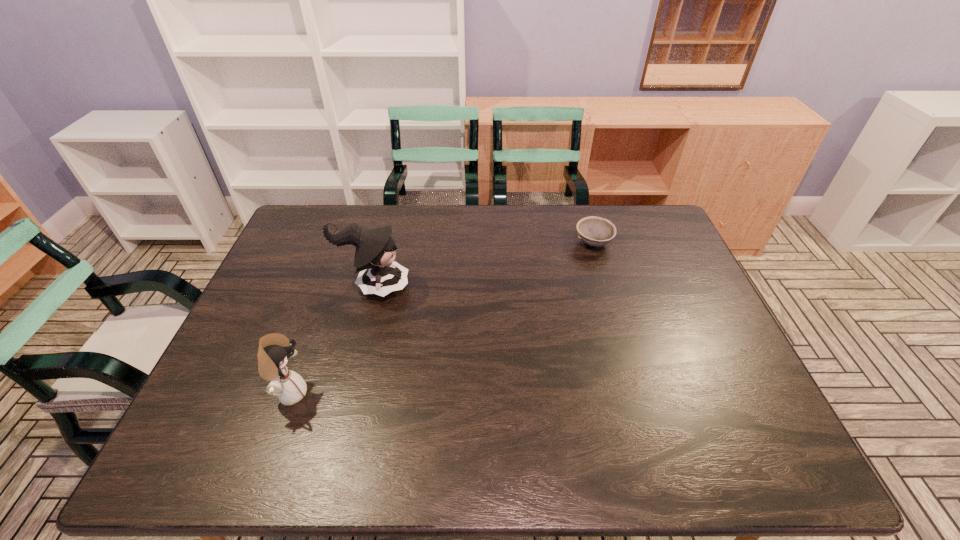
The image size is (960, 540). In order to click on vacant space at the far edge of the desktop in this screenshot , I will do `click(549, 225)`.

In the image, there is a desktop. Identify the location of free space at the near edge. The height and width of the screenshot is (540, 960). (445, 440).

You are a GUI agent. You are given a task and a screenshot of the screen. Output one action in this format:
    pyautogui.click(x=<x>, y=<y>)
    Task: Click on the vacant space at the left edge
    The height and width of the screenshot is (540, 960).
    Given the screenshot: What is the action you would take?
    pyautogui.click(x=256, y=424)

I want to click on vacant space at the right edge of the desktop, so click(x=705, y=319).

Image resolution: width=960 pixels, height=540 pixels. Find the location of `vacant space at the far left corner`. vacant space at the far left corner is located at coordinates (302, 220).

The image size is (960, 540). What are the coordinates of `free region at the far right corner of the desktop` in the screenshot? It's located at (647, 213).

Image resolution: width=960 pixels, height=540 pixels. What are the coordinates of `free space at the near right corner of the desktop` in the screenshot? It's located at (717, 446).

Locate an element on the screen. This screenshot has width=960, height=540. vacant area between the shorter doll and the bowl is located at coordinates (442, 318).

The width and height of the screenshot is (960, 540). I want to click on free space between the shorter doll and the bowl, so click(442, 318).

Where is `vacant area that lies between the nearest object and the rightmost object`? The image size is (960, 540). vacant area that lies between the nearest object and the rightmost object is located at coordinates (442, 318).